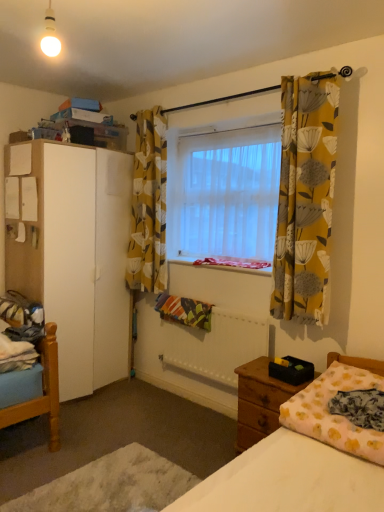
Find the location of a particular element. This screenshot has width=384, height=512. free space above white fabric bed at lower right (from a real-world perspective) is located at coordinates (124, 454).